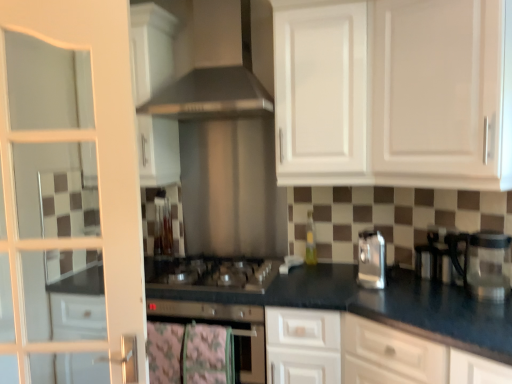
Find the location of `free spot in front of satin silver toaster at right`. free spot in front of satin silver toaster at right is located at coordinates (386, 301).